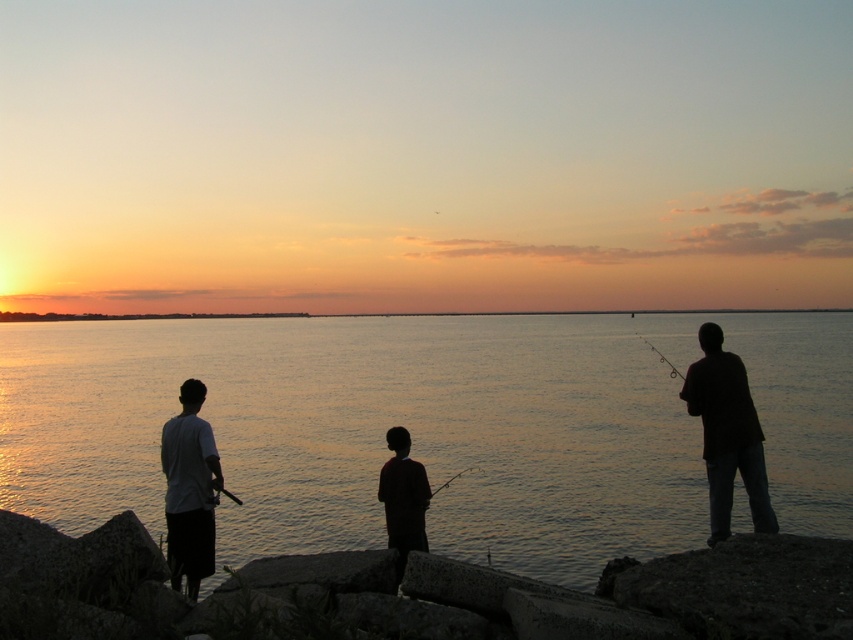
Based on the scene description, where is the silvery water at center located in the image?

The silvery water at center is located at point (425, 428) in the image.

You are a photographer trying to capture the sunset scene. You notice the silvery water at center and the smooth black rod at center in your frame. Which object occupies more horizontal space in the image?

The silvery water at center might be wider than smooth black rod at center according to the description.